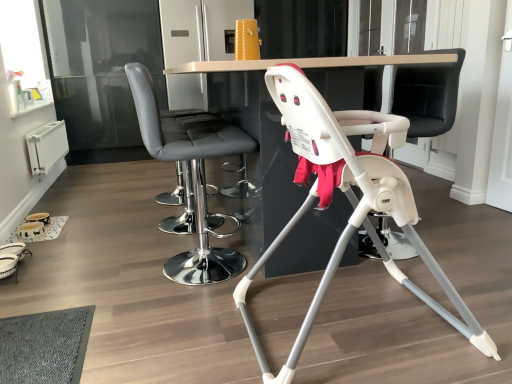
At what (x,y) coordinates should I click in order to perform the action: click on vacant region to the left of matte gray bar stool at center, marked as the second chair in a right-to-left arrangement. Please return your answer as a coordinate pair (x, y). Looking at the image, I should click on (115, 269).